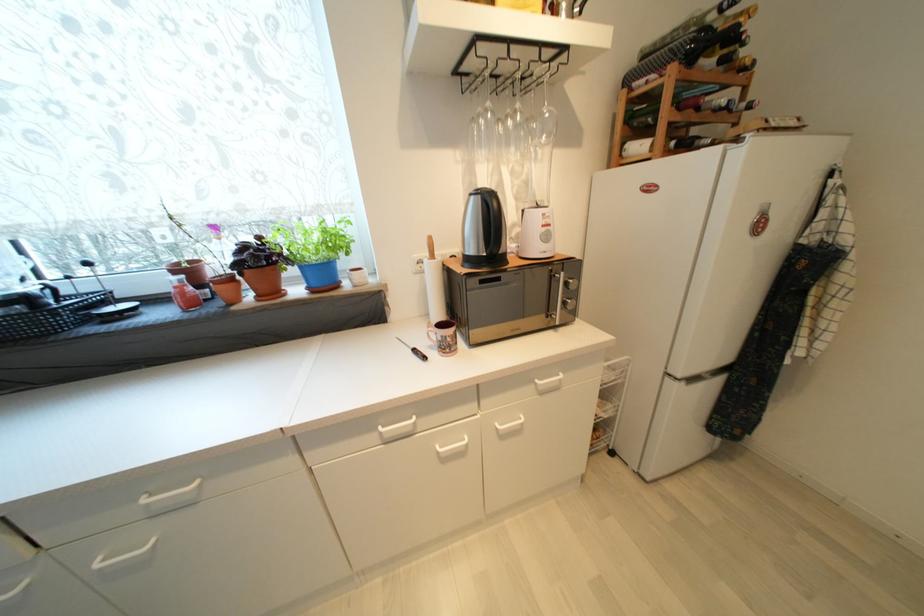
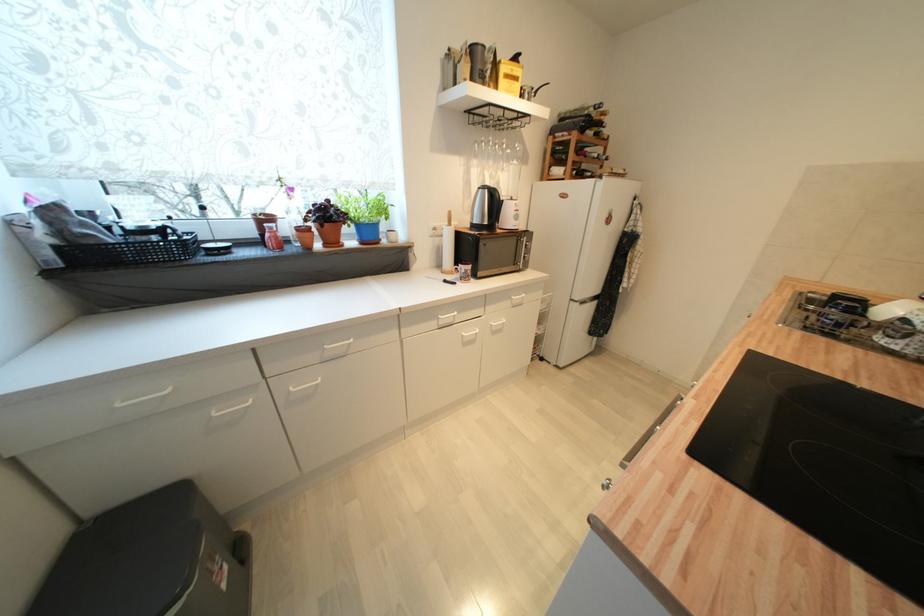
Locate, in the second image, the point that corresponds to (x=697, y=382) in the first image.

(587, 304)